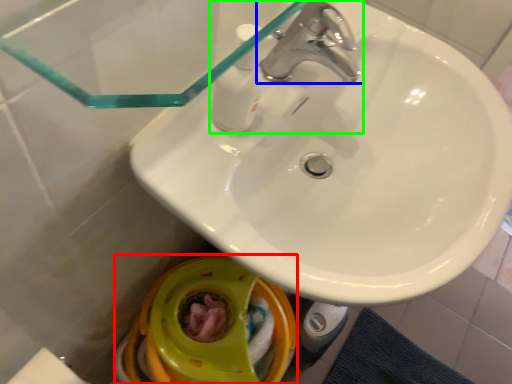
Question: Based on their relative distances, which object is nearer to toilet bowl (highlighted by a red box)? Choose from tap (highlighted by a blue box) and tap (highlighted by a green box).

Choices:
 (A) tap
 (B) tap

Answer: (B)